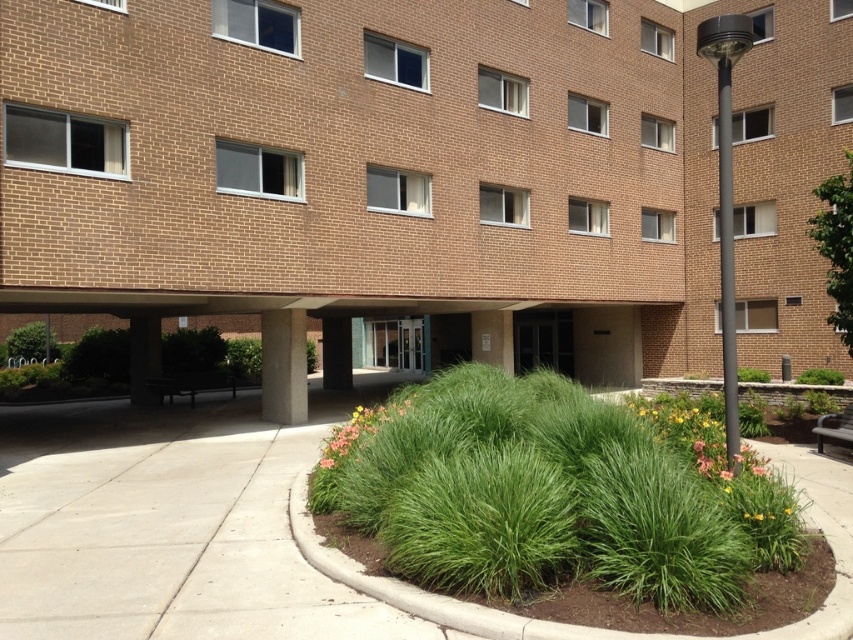
Question: Estimate the real-world distances between objects in this image. Which object is farther from the green leafy grass at center?

Choices:
 (A) green grassy bush at center
 (B) green grassy bush at lower left

Answer: (B)

Question: Among these points, which one is nearest to the camera?

Choices:
 (A) (49, 356)
 (B) (728, 200)
 (C) (804, 376)

Answer: (B)

Question: Can you confirm if green leafy grass at center is positioned to the left of black metal pole at right?

Choices:
 (A) yes
 (B) no

Answer: (A)

Question: Can you confirm if green leafy grass at center is positioned above green grassy bush at center?

Choices:
 (A) yes
 (B) no

Answer: (A)

Question: Based on their relative distances, which object is farther from the green leafy grass at center?

Choices:
 (A) black metallic pole at right
 (B) green grassy bush at lower left
 (C) concrete at center

Answer: (B)

Question: Is green grassy bush at lower left thinner than green grassy bush at center?

Choices:
 (A) yes
 (B) no

Answer: (B)